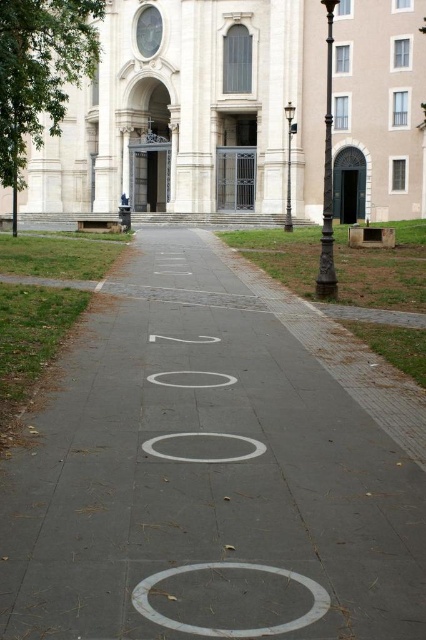
You are standing on the pathway leading to the cathedral and notice two white markings. One is the white concrete pavement at center, and the other is the white matte circle at center. Which of these two is positioned higher up in the image?

The white concrete pavement at center is located above the white matte circle at center, so it is positioned higher up in the image.